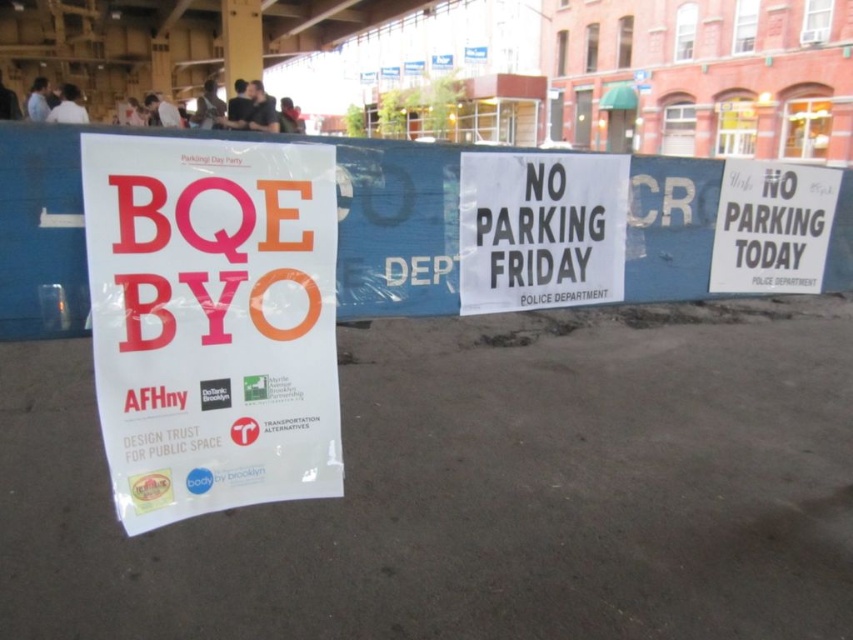
Question: Which point is farther to the camera?

Choices:
 (A) (189, 204)
 (B) (839, 221)

Answer: (B)

Question: Does white paper poster at center have a larger size compared to white paper sign at center?

Choices:
 (A) no
 (B) yes

Answer: (B)

Question: Is white paper poster at center smaller than white paper sign at center?

Choices:
 (A) yes
 (B) no

Answer: (B)

Question: Is white paper poster at center above white paper sign at center?

Choices:
 (A) yes
 (B) no

Answer: (B)